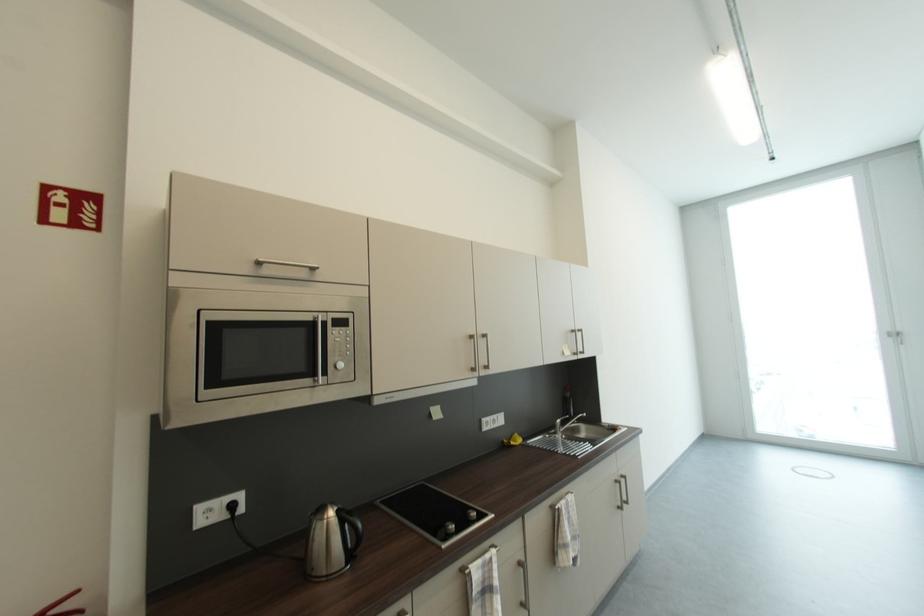
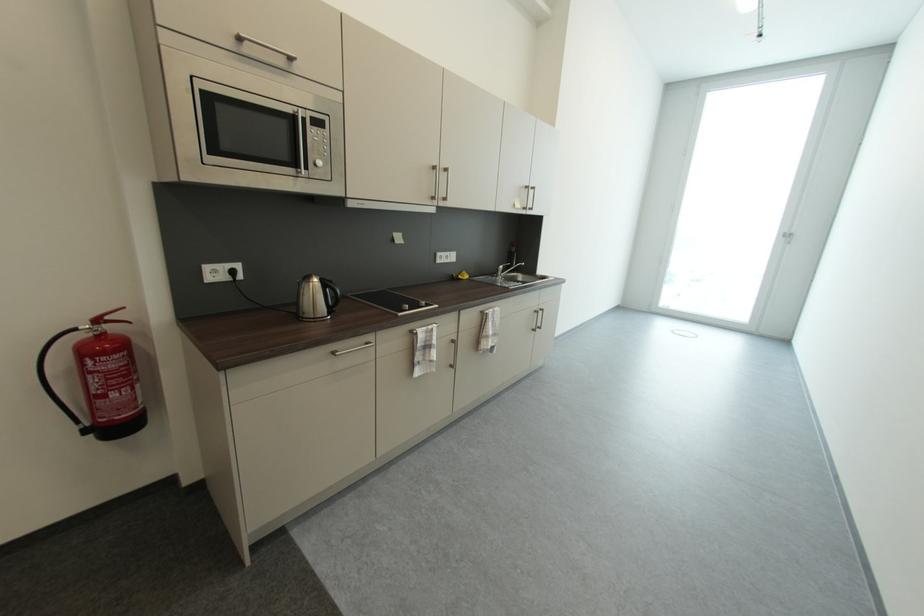
The point at (560, 434) is marked in the first image. Where is the corresponding point in the second image?

(502, 277)